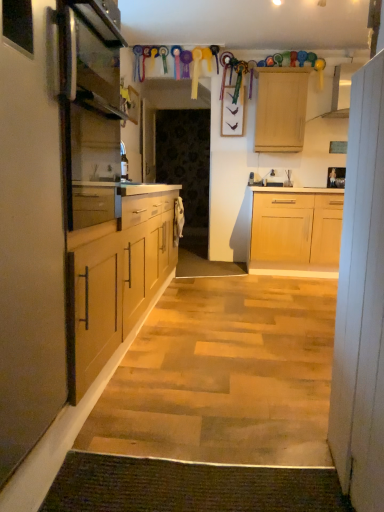
Question: Should I look upward or downward to see wooden picture frame at upper right?

Choices:
 (A) down
 (B) up

Answer: (B)

Question: Is wooden picture frame at upper right to the right of green textured mat at lower center from the viewer's perspective?

Choices:
 (A) yes
 (B) no

Answer: (A)

Question: Is wooden picture frame at upper right taller than green textured mat at lower center?

Choices:
 (A) yes
 (B) no

Answer: (A)

Question: Could you tell me if wooden picture frame at upper right is facing green textured mat at lower center?

Choices:
 (A) yes
 (B) no

Answer: (A)

Question: From a real-world perspective, is wooden picture frame at upper right on top of green textured mat at lower center?

Choices:
 (A) no
 (B) yes

Answer: (B)

Question: Is wooden picture frame at upper right closer to the viewer compared to green textured mat at lower center?

Choices:
 (A) no
 (B) yes

Answer: (A)

Question: From a real-world perspective, is wooden picture frame at upper right under green textured mat at lower center?

Choices:
 (A) yes
 (B) no

Answer: (B)

Question: Can green textured mat at lower center be found inside wooden cabinet at upper center?

Choices:
 (A) no
 (B) yes

Answer: (A)

Question: From the image's perspective, is wooden cabinet at upper center on green textured mat at lower center?

Choices:
 (A) no
 (B) yes

Answer: (B)

Question: Is wooden cabinet at upper center aimed at green textured mat at lower center?

Choices:
 (A) yes
 (B) no

Answer: (A)

Question: Are wooden cabinet at upper center and green textured mat at lower center located far from each other?

Choices:
 (A) yes
 (B) no

Answer: (A)

Question: Can you confirm if wooden cabinet at upper center is bigger than green textured mat at lower center?

Choices:
 (A) yes
 (B) no

Answer: (A)

Question: Is wooden cabinet at upper center positioned beyond the bounds of green textured mat at lower center?

Choices:
 (A) no
 (B) yes

Answer: (B)

Question: Is satin silver oven at left oriented towards wooden picture frame at upper right?

Choices:
 (A) no
 (B) yes

Answer: (A)